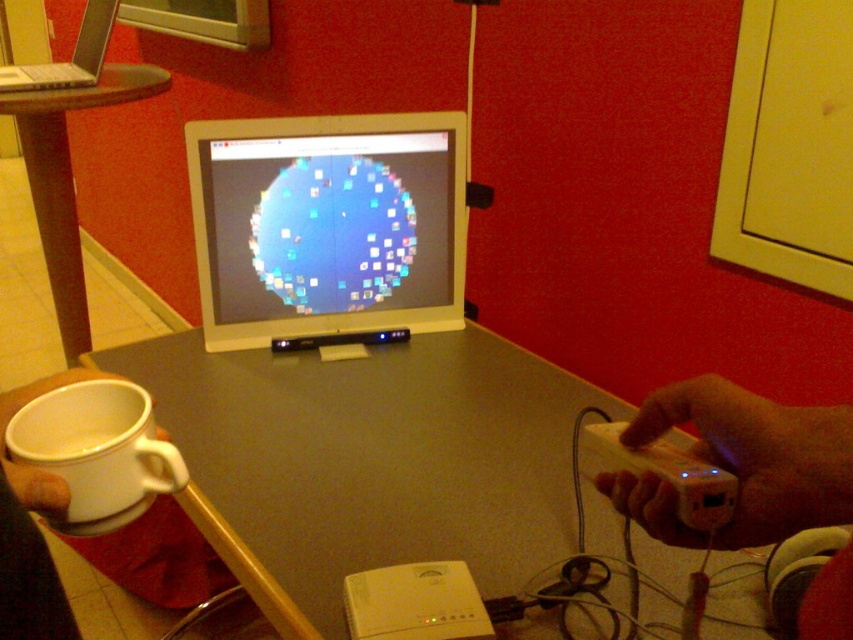
You are organizing a desk and need to place the white plastic game controller at lower right and the silver metallic laptop at upper left. Given their sizes, which object should you place first to ensure enough space?

The white plastic game controller at lower right is shorter than the silver metallic laptop at upper left. Since the laptop is taller, you should place the silver metallic laptop at upper left first to ensure adequate space for the shorter controller.

You are organizing a desk setup and need to place a new keyboard between the smooth gray table at center and the brown wooden table at left. According to the scene description, which table should the keyboard be placed closer to?

The keyboard should be placed closer to the brown wooden table at left because the smooth gray table at center is to the right of the brown wooden table at left, so the brown wooden table is on the left side.